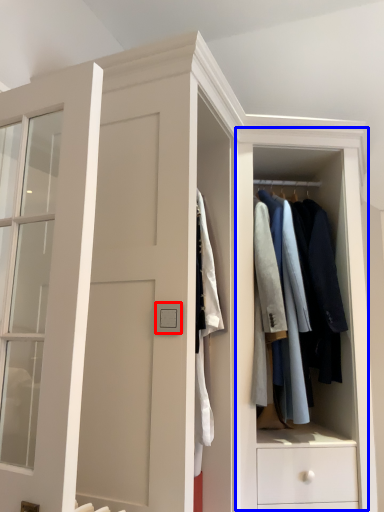
Question: Which object is further to the camera taking this photo, light switch (highlighted by a red box) or dresser (highlighted by a blue box)?

Choices:
 (A) light switch
 (B) dresser

Answer: (B)